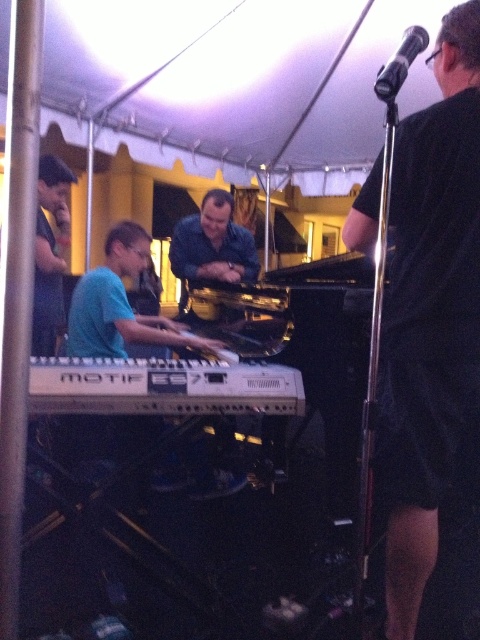
You are a photographer at the event and want to capture a photo that includes both the black matte shirt at right and the black metallic microphone at upper right. Based on their positions, which object should you focus on first to ensure both are in frame?

The black matte shirt at right is located below the black metallic microphone at upper right. To include both in the frame, focus on the microphone first as it is higher up, then adjust to ensure the shirt is visible below.

You are a photographer at the event. You want to capture a photo where the black matte shirt at right and the teal matte keyboard at center are both clearly visible. Considering their sizes, which object should you focus on to ensure both are in frame?

The black matte shirt at right is much taller than the teal matte keyboard at center, so focusing on the taller object, the black matte shirt at right, will ensure both are in frame.